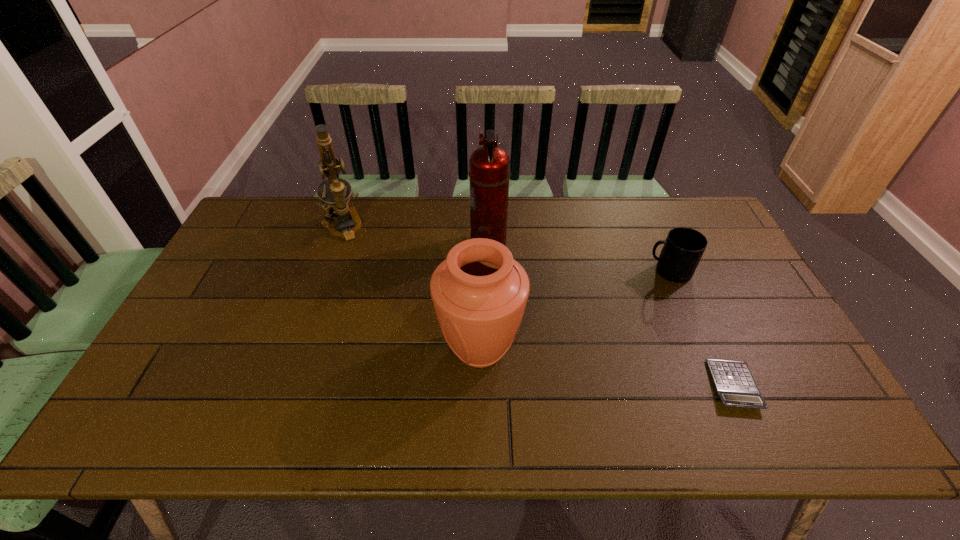
At what (x,y) coordinates should I click in order to perform the action: click on vacant region located on the side of the mug with the handle. Please return your answer as a coordinate pair (x, y). Looking at the image, I should click on (519, 272).

Where is `free spot located on the side of the mug with the handle`? This screenshot has height=540, width=960. free spot located on the side of the mug with the handle is located at coordinates (530, 272).

Locate an element on the screen. The width and height of the screenshot is (960, 540). vacant space located 0.230m on the side of the mug with the handle is located at coordinates (569, 272).

Identify the location of vacant space located 0.380m on the back of the calculator. (674, 258).

Find the location of a particular element. The image size is (960, 540). fire extinguisher located in the far edge section of the desktop is located at coordinates (489, 166).

At what (x,y) coordinates should I click in order to perform the action: click on microscope positioned at the far edge. Please return your answer as a coordinate pair (x, y). Looking at the image, I should click on (336, 202).

Locate an element on the screen. The image size is (960, 540). object positioned at the near edge is located at coordinates (734, 383).

Where is `object that is positioned at the right edge`? object that is positioned at the right edge is located at coordinates (734, 383).

Locate an element on the screen. object present at the near right corner is located at coordinates (734, 383).

You are a GUI agent. You are given a task and a screenshot of the screen. Output one action in this format:
    pyautogui.click(x=<x>, y=<y>)
    Task: Click on the vacant area at the far edge
    
    Given the screenshot: What is the action you would take?
    pyautogui.click(x=353, y=202)